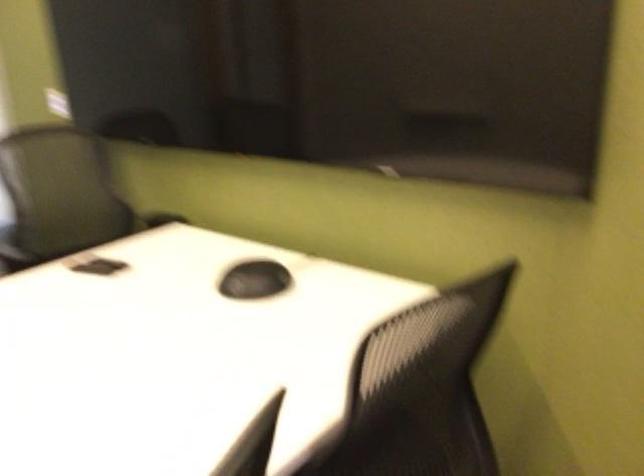
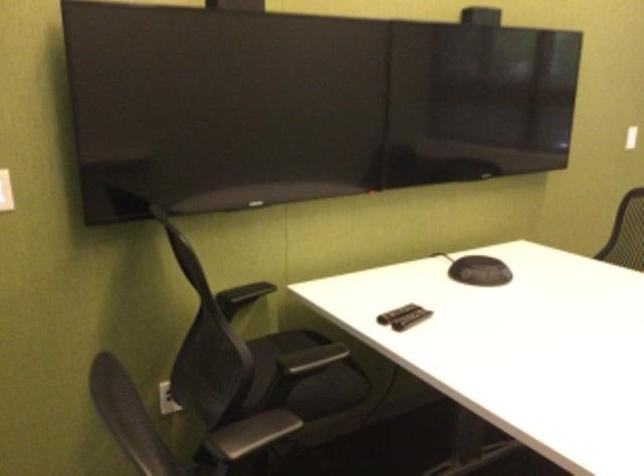
Find the pixel in the second image that matches (x=108, y=259) in the first image.

(395, 313)